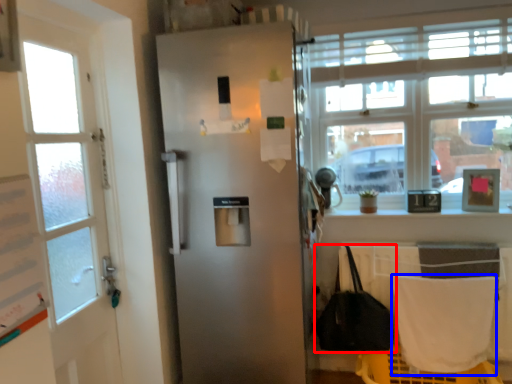
Question: Among these objects, which one is farthest to the camera, handbag (highlighted by a red box) or blanket (highlighted by a blue box)?

Choices:
 (A) handbag
 (B) blanket

Answer: (A)